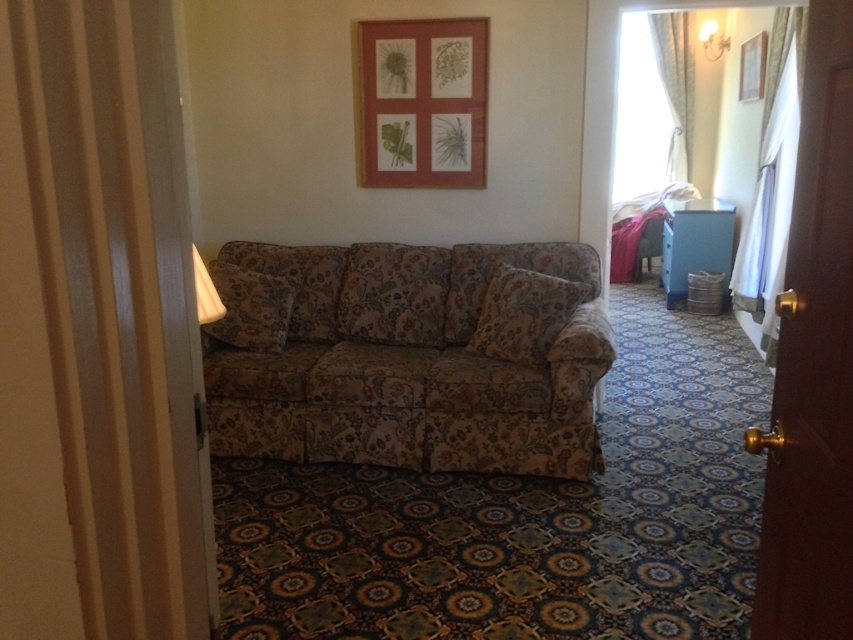
Does floral fabric couch at center come behind wooden picture frame at upper center?

No.

What do you see at coordinates (410, 355) in the screenshot?
I see `floral fabric couch at center` at bounding box center [410, 355].

Identify the location of floral fabric couch at center. The height and width of the screenshot is (640, 853). (410, 355).

What do you see at coordinates (421, 102) in the screenshot?
I see `wooden picture frame at upper center` at bounding box center [421, 102].

Does point (421, 40) come farther from viewer compared to point (637, 275)?

No, it is not.

Find the location of a particular element. The image size is (853, 640). wooden picture frame at upper center is located at coordinates (421, 102).

Does floral fabric couch at center have a lesser width compared to floral fabric armchair at center?

Incorrect, floral fabric couch at center's width is not less than floral fabric armchair at center's.

Who is more distant from viewer, (521, 248) or (642, 259)?

The point (642, 259) is behind.

Locate an element on the screen. floral fabric couch at center is located at coordinates (410, 355).